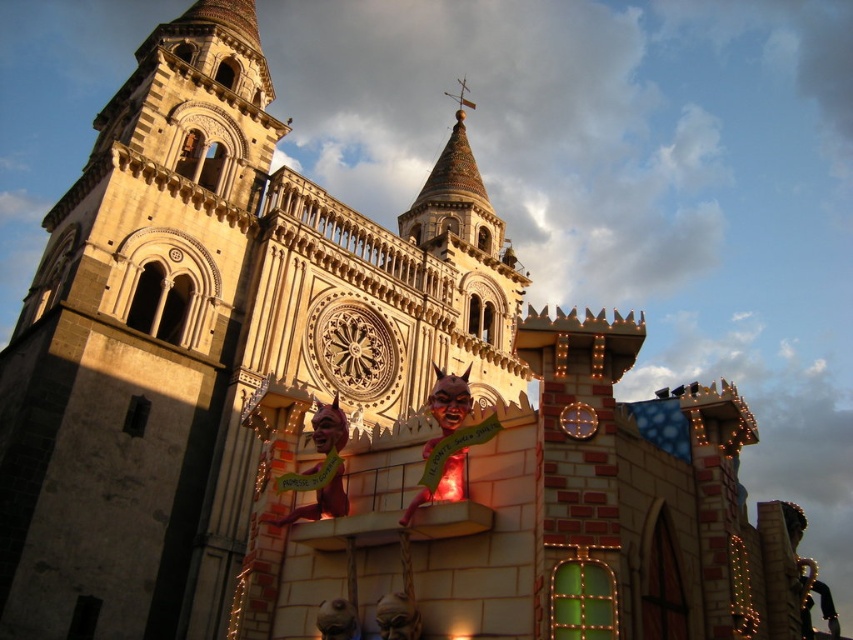
Question: Can you confirm if beige stone tower at center is positioned to the right of metallic gold clock at center?

Choices:
 (A) yes
 (B) no

Answer: (B)

Question: Does beige stone tower at center appear over metallic gold clock at center?

Choices:
 (A) no
 (B) yes

Answer: (B)

Question: Which object is closer to the camera taking this photo?

Choices:
 (A) beige stone tower at center
 (B) metallic gold clock at center

Answer: (B)

Question: Where is beige stone tower at center located in relation to metallic gold clock at center in the image?

Choices:
 (A) below
 (B) above

Answer: (B)

Question: Among these points, which one is nearest to the camera?

Choices:
 (A) (7, 412)
 (B) (589, 412)

Answer: (B)